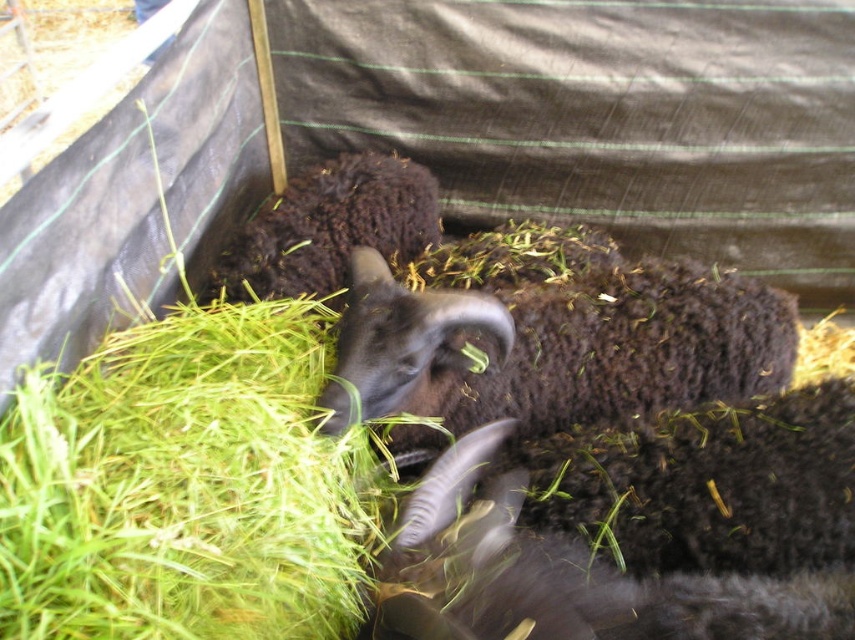
You are a farmer checking on your animals. You see the green grass at lower left and the dark brown woolen sheep at center. Which object is located on the left side of the enclosure?

The green grass at lower left is located on the left side of the enclosure, as it is positioned to the left of the dark brown woolen sheep at center.

From the picture: Where is the dark woolen goat at center located in the image?

The dark woolen goat at center is located at point [557,346] in the image.